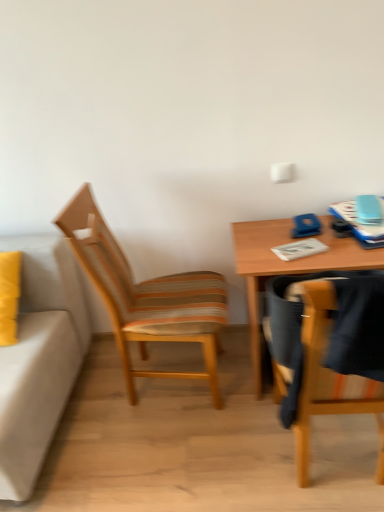
The width and height of the screenshot is (384, 512). What are the coordinates of `free point below woodenchair at left, the first chair when ordered from back to front (from a real-world perspective)` in the screenshot? It's located at pyautogui.click(x=178, y=387).